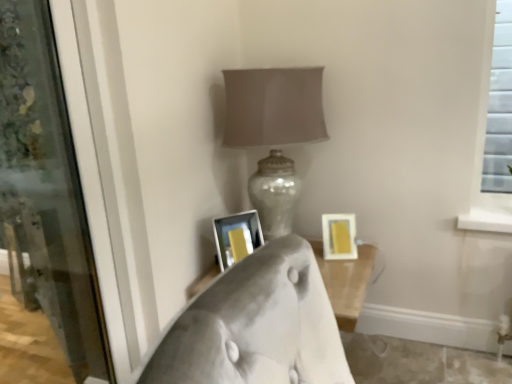
Question: Considering the relative sizes of matte silver lamp at center and white glossy picture frame at center, the first picture frame from the left, in the image provided, is matte silver lamp at center wider than white glossy picture frame at center, the first picture frame from the left,?

Choices:
 (A) yes
 (B) no

Answer: (A)

Question: Does matte silver lamp at center have a larger size compared to white glossy picture frame at center, which is the 2th picture frame in right-to-left order?

Choices:
 (A) no
 (B) yes

Answer: (B)

Question: Is matte silver lamp at center far away from white glossy picture frame at center, which is the 2th picture frame in right-to-left order?

Choices:
 (A) no
 (B) yes

Answer: (A)

Question: Is white glossy picture frame at center, the first picture frame from the left, located within matte silver lamp at center?

Choices:
 (A) yes
 (B) no

Answer: (B)

Question: Can you confirm if matte silver lamp at center is shorter than white glossy picture frame at center, which is the 2th picture frame in right-to-left order?

Choices:
 (A) no
 (B) yes

Answer: (A)

Question: Looking at their shapes, would you say transparent glass screen door at left is wider or thinner than white glossy picture frame at center, the first picture frame from the left?

Choices:
 (A) wide
 (B) thin

Answer: (B)

Question: Is point (6, 223) closer or farther from the camera than point (232, 225)?

Choices:
 (A) closer
 (B) farther

Answer: (B)

Question: From their relative heights in the image, would you say transparent glass screen door at left is taller or shorter than white glossy picture frame at center, which is the 2th picture frame in right-to-left order?

Choices:
 (A) tall
 (B) short

Answer: (A)

Question: From the image's perspective, is transparent glass screen door at left positioned above or below white glossy picture frame at center, which is the 2th picture frame in right-to-left order?

Choices:
 (A) below
 (B) above

Answer: (B)

Question: Based on their sizes in the image, would you say white glossy picture frame at center, which is the 2th picture frame in right-to-left order, is bigger or smaller than yellow matte picture frame at lower right, which appears as the second picture frame when viewed from the left?

Choices:
 (A) big
 (B) small

Answer: (A)

Question: Does point (216, 243) appear closer or farther from the camera than point (324, 254)?

Choices:
 (A) farther
 (B) closer

Answer: (B)

Question: Is white glossy picture frame at center, the first picture frame from the left, wider or thinner than yellow matte picture frame at lower right, arranged as the first picture frame when viewed from the right?

Choices:
 (A) wide
 (B) thin

Answer: (A)

Question: In terms of height, does white glossy picture frame at center, which is the 2th picture frame in right-to-left order, look taller or shorter compared to yellow matte picture frame at lower right, arranged as the first picture frame when viewed from the right?

Choices:
 (A) short
 (B) tall

Answer: (B)

Question: From a real-world perspective, is yellow matte picture frame at lower right, which appears as the second picture frame when viewed from the left, above or below transparent glass screen door at left?

Choices:
 (A) above
 (B) below

Answer: (B)

Question: From their relative heights in the image, would you say yellow matte picture frame at lower right, arranged as the first picture frame when viewed from the right, is taller or shorter than transparent glass screen door at left?

Choices:
 (A) short
 (B) tall

Answer: (A)